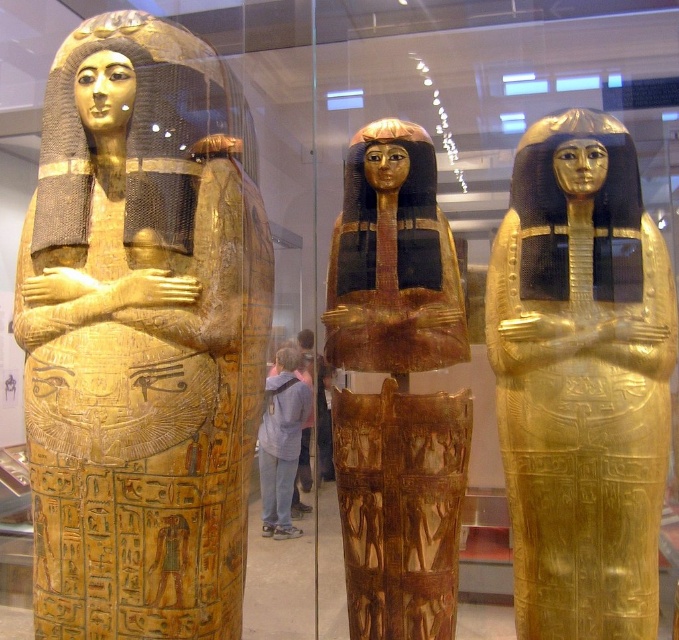
Is gold polished sarcophagus at left to the left of gold polished wood sarcophagus at center from the viewer's perspective?

Correct, you'll find gold polished sarcophagus at left to the left of gold polished wood sarcophagus at center.

Is point (103, 26) less distant than point (369, 317)?

That is True.

The width and height of the screenshot is (679, 640). I want to click on gold polished sarcophagus at left, so click(x=141, y=336).

The width and height of the screenshot is (679, 640). What are the coordinates of `gold polished sarcophagus at left` in the screenshot? It's located at (141, 336).

Consider the image. Which is more to the right, gold polished sarcophagus at center or gold polished wood sarcophagus at center?

gold polished sarcophagus at center

Does gold polished sarcophagus at center have a lesser height compared to gold polished wood sarcophagus at center?

Yes.

Does point (557, 422) lie in front of point (403, 195)?

Yes, point (557, 422) is closer to viewer.

The width and height of the screenshot is (679, 640). What are the coordinates of `gold polished sarcophagus at center` in the screenshot? It's located at (581, 380).

Can you confirm if gold polished sarcophagus at left is shorter than gold polished sarcophagus at center?

Incorrect, gold polished sarcophagus at left's height does not fall short of gold polished sarcophagus at center's.

Which of these two, gold polished sarcophagus at left or gold polished sarcophagus at center, stands shorter?

With less height is gold polished sarcophagus at center.

Which is in front, point (242, 340) or point (644, 604)?

Point (242, 340)

You are a GUI agent. You are given a task and a screenshot of the screen. Output one action in this format:
    pyautogui.click(x=<x>, y=<y>)
    Task: Click on the gold polished sarcophagus at left
    
    Given the screenshot: What is the action you would take?
    pyautogui.click(x=141, y=336)